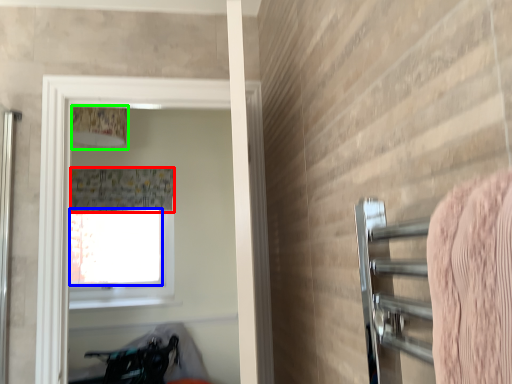
Question: Which is farther away from shower curtain (highlighted by a red box)? window screen (highlighted by a blue box) or lamp (highlighted by a green box)?

Choices:
 (A) window screen
 (B) lamp

Answer: (B)